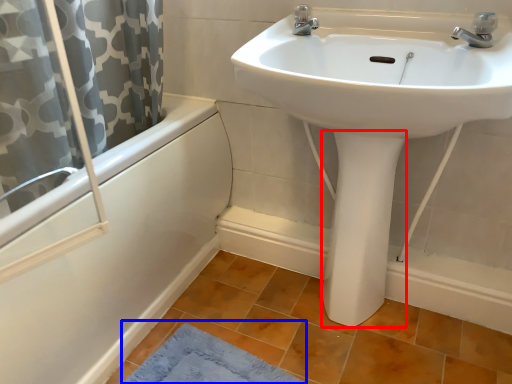
Question: Which point is further to the camera, bidet (highlighted by a red box) or bath mat (highlighted by a blue box)?

Choices:
 (A) bidet
 (B) bath mat

Answer: (A)